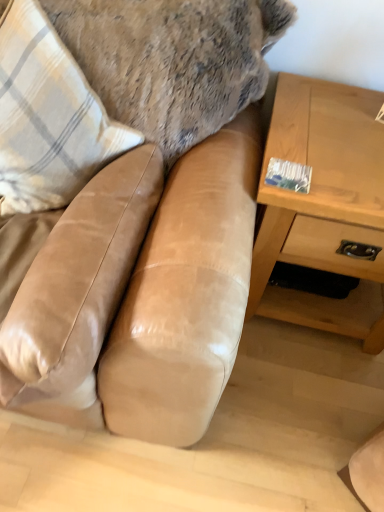
The height and width of the screenshot is (512, 384). I want to click on free space above light brown wood table at right (from a real-world perspective), so click(342, 129).